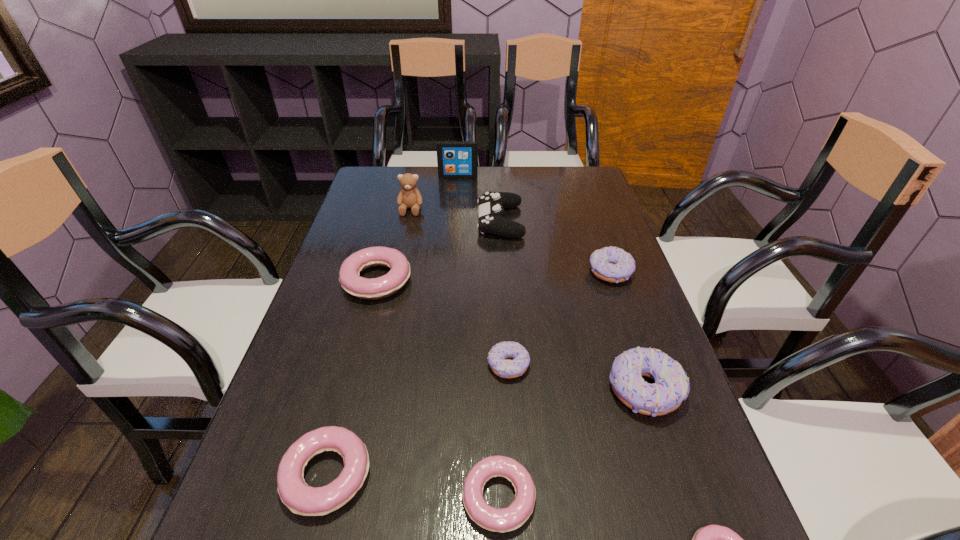
Where is `free spot that satisfies the following two spatial constraints: 1. on the back side of the second smallest pink doughnut; 2. on the right side of the leftmost brown doughnut`? Image resolution: width=960 pixels, height=540 pixels. free spot that satisfies the following two spatial constraints: 1. on the back side of the second smallest pink doughnut; 2. on the right side of the leftmost brown doughnut is located at coordinates (494, 366).

This screenshot has height=540, width=960. Identify the location of free space that satisfies the following two spatial constraints: 1. on the surface of the tallest doughnut; 2. on the left side of the control. (511, 390).

The width and height of the screenshot is (960, 540). I want to click on vacant space that satisfies the following two spatial constraints: 1. on the front-facing side of the tallest doughnut; 2. on the right side of the brown teddy bear, so click(x=372, y=390).

Identify the location of free location that satisfies the following two spatial constraints: 1. on the surface of the black control; 2. on the right side of the biggest brown doughnut. The height and width of the screenshot is (540, 960). (511, 390).

The height and width of the screenshot is (540, 960). I want to click on free spot that satisfies the following two spatial constraints: 1. on the back side of the tallest doughnut; 2. on the left side of the second biggest brown doughnut, so click(x=606, y=272).